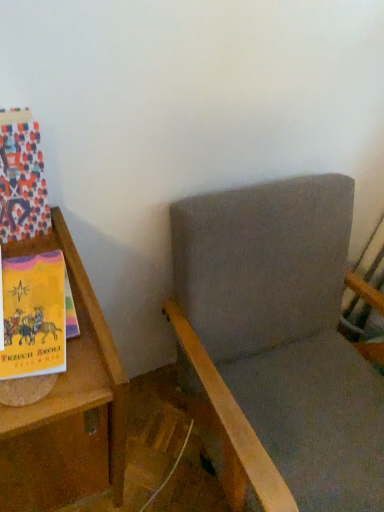
Question: Does multicolored paper at left have a lesser height compared to wooden bookshelf at left?

Choices:
 (A) yes
 (B) no

Answer: (A)

Question: From a real-world perspective, does multicolored paper at left sit lower than wooden bookshelf at left?

Choices:
 (A) no
 (B) yes

Answer: (A)

Question: Is multicolored paper at left at the right side of wooden bookshelf at left?

Choices:
 (A) yes
 (B) no

Answer: (B)

Question: Does multicolored paper at left have a lesser width compared to wooden bookshelf at left?

Choices:
 (A) yes
 (B) no

Answer: (A)

Question: Does multicolored paper at left have a smaller size compared to wooden bookshelf at left?

Choices:
 (A) no
 (B) yes

Answer: (B)

Question: Does multicolored paper at left have a larger size compared to wooden bookshelf at left?

Choices:
 (A) no
 (B) yes

Answer: (A)

Question: Considering the relative sizes of multicolored paper at left and gray fabric rocking chair at center in the image provided, is multicolored paper at left taller than gray fabric rocking chair at center?

Choices:
 (A) yes
 (B) no

Answer: (B)

Question: From the image's perspective, is multicolored paper at left on gray fabric rocking chair at center?

Choices:
 (A) yes
 (B) no

Answer: (A)

Question: Is multicolored paper at left behind gray fabric rocking chair at center?

Choices:
 (A) no
 (B) yes

Answer: (B)

Question: Is the surface of multicolored paper at left in direct contact with gray fabric rocking chair at center?

Choices:
 (A) no
 (B) yes

Answer: (A)

Question: From the image's perspective, is multicolored paper at left beneath gray fabric rocking chair at center?

Choices:
 (A) yes
 (B) no

Answer: (B)

Question: Considering the relative positions of multicolored paper at left and gray fabric rocking chair at center in the image provided, is multicolored paper at left to the left of gray fabric rocking chair at center from the viewer's perspective?

Choices:
 (A) yes
 (B) no

Answer: (A)

Question: From the image's perspective, does wooden bookshelf at left appear lower than gray fabric rocking chair at center?

Choices:
 (A) yes
 (B) no

Answer: (A)